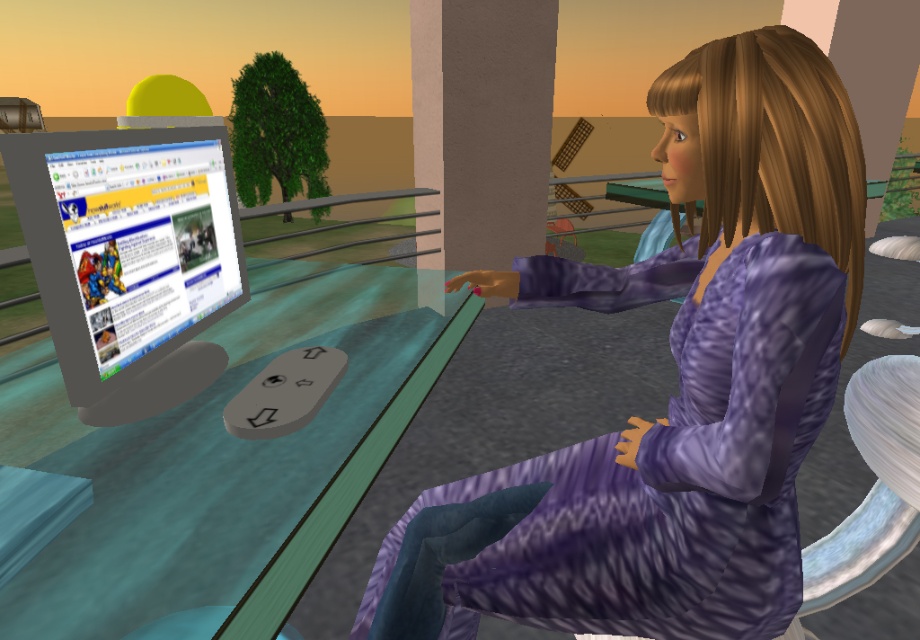
You are a character in the scene and want to determine which of the two points, point (756,144) or point (144,369), is closer to you. Based on the scene description, which point is nearer?

Point (756,144) is closer to the camera than point (144,369), so it is nearer to you.